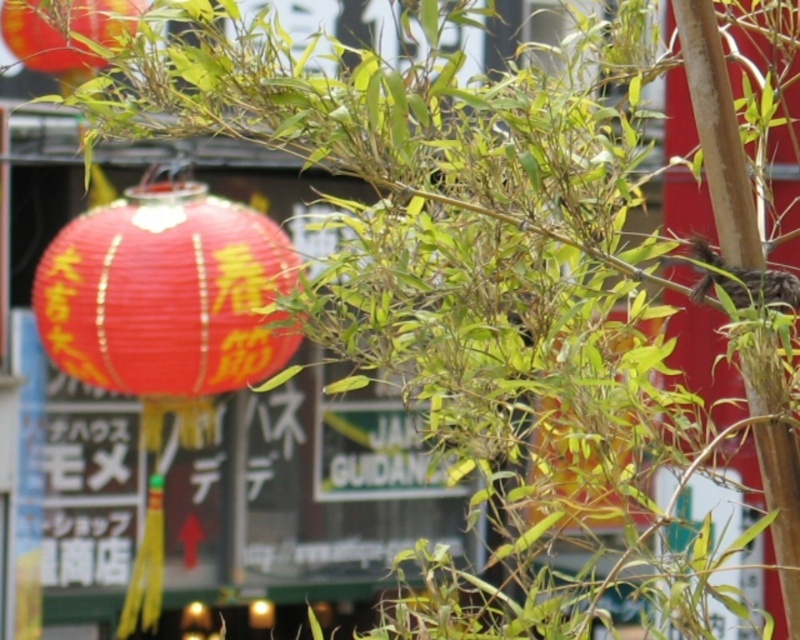
Does bamboo at center have a larger size compared to matte paper lantern at upper left?

No, bamboo at center is not bigger than matte paper lantern at upper left.

Image resolution: width=800 pixels, height=640 pixels. What do you see at coordinates (718, 132) in the screenshot?
I see `bamboo at center` at bounding box center [718, 132].

Identify the location of bamboo at center. This screenshot has height=640, width=800. (718, 132).

Is point (100, 227) positioned before point (726, 189)?

No.

The image size is (800, 640). What do you see at coordinates (166, 301) in the screenshot?
I see `matte paper lantern at center` at bounding box center [166, 301].

Is point (156, 320) more distant than point (788, 540)?

Yes, it is.

Locate an element on the screen. matte paper lantern at center is located at coordinates (166, 301).

Which is more to the left, matte paper lantern at center or matte paper lantern at upper left?

Positioned to the left is matte paper lantern at upper left.

Does matte paper lantern at center have a greater height compared to matte paper lantern at upper left?

Correct, matte paper lantern at center is much taller as matte paper lantern at upper left.

Is point (126, 282) less distant than point (48, 58)?

No, (126, 282) is further to viewer.

You are a GUI agent. You are given a task and a screenshot of the screen. Output one action in this format:
    pyautogui.click(x=<x>, y=<y>)
    Task: Click on the matte paper lantern at center
    The image size is (800, 640).
    Given the screenshot: What is the action you would take?
    pyautogui.click(x=166, y=301)